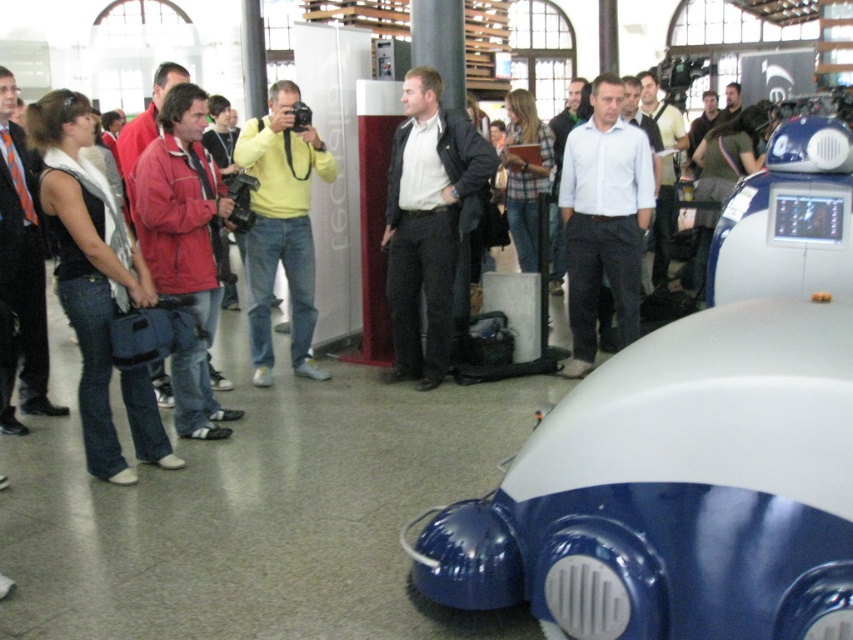
Does point (412, 278) lie behind point (303, 340)?

No, (412, 278) is closer to viewer.

Between point (434, 83) and point (251, 141), which one is positioned in front?

Positioned in front is point (434, 83).

Where is `matte black jacket at center`? matte black jacket at center is located at coordinates (427, 221).

Can you confirm if white shirt at center is positioned above yellow matte shirt at center?

Indeed, white shirt at center is positioned over yellow matte shirt at center.

The width and height of the screenshot is (853, 640). What do you see at coordinates (604, 220) in the screenshot?
I see `white shirt at center` at bounding box center [604, 220].

In order to click on white shirt at center in this screenshot , I will do `click(604, 220)`.

Where is `matte black jacket at center`? matte black jacket at center is located at coordinates (427, 221).

What do you see at coordinates (427, 221) in the screenshot? Image resolution: width=853 pixels, height=640 pixels. I see `matte black jacket at center` at bounding box center [427, 221].

Between point (482, 152) and point (569, 256), which one is positioned in front?

Positioned in front is point (482, 152).

Identify the location of matte black jacket at center. The image size is (853, 640). (427, 221).